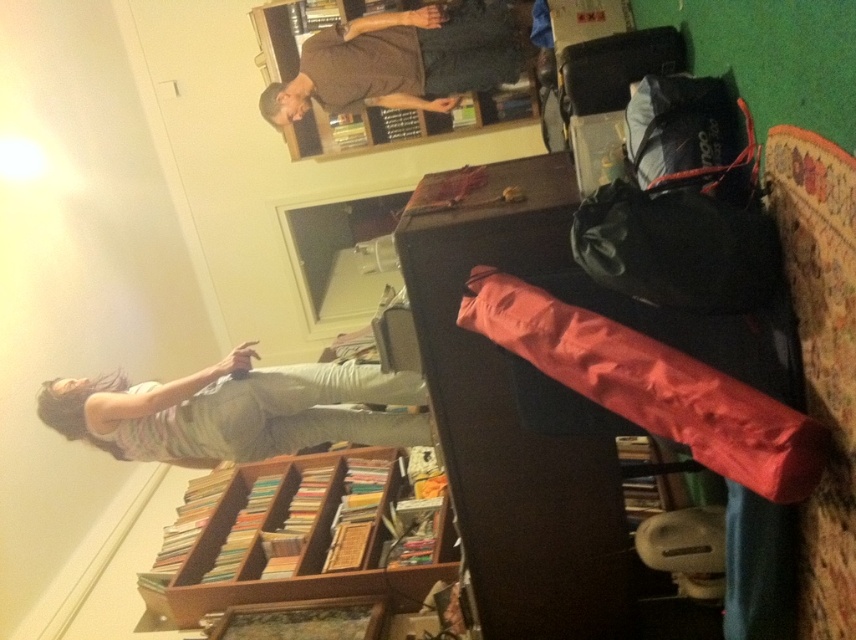
You are trying to decide whether to place a new large sculpture on the wooden bookshelf at lower center or hang the striped cotton shirt at lower left on a hook. Based on their sizes, which object would be more suitable for the sculpture?

The wooden bookshelf at lower center is bigger than the striped cotton shirt at lower left, so the sculpture would be more suitable for the wooden bookshelf at lower center.

You are standing in the room and want to reach both the wooden bookshelf at lower center and the brown matte shirt at upper center. Which object will you need to walk towards first?

You will need to walk towards the wooden bookshelf at lower center first because it is closer to you than the brown matte shirt at upper center.

You are trying to decide whether to place a tall plant next to the wooden bookshelf at lower center or the brown matte shirt at upper center. Based on their heights, which object would allow the plant to fit better without exceeding its height?

The wooden bookshelf at lower center has a greater height compared to the brown matte shirt at upper center, so placing the tall plant next to the wooden bookshelf at lower center would be better as it can accommodate the plant without exceeding its height.